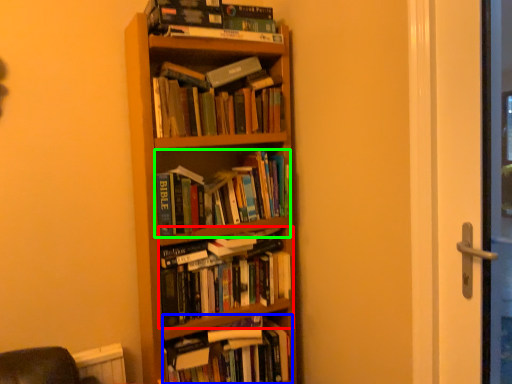
Question: Which object is the farthest from book (highlighted by a red box)? Choose among these: book (highlighted by a blue box) or book (highlighted by a green box).

Choices:
 (A) book
 (B) book

Answer: (B)